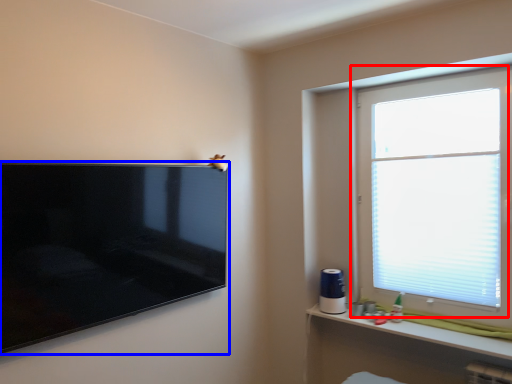
Question: Among these objects, which one is farthest to the camera, window (highlighted by a red box) or television (highlighted by a blue box)?

Choices:
 (A) window
 (B) television

Answer: (A)